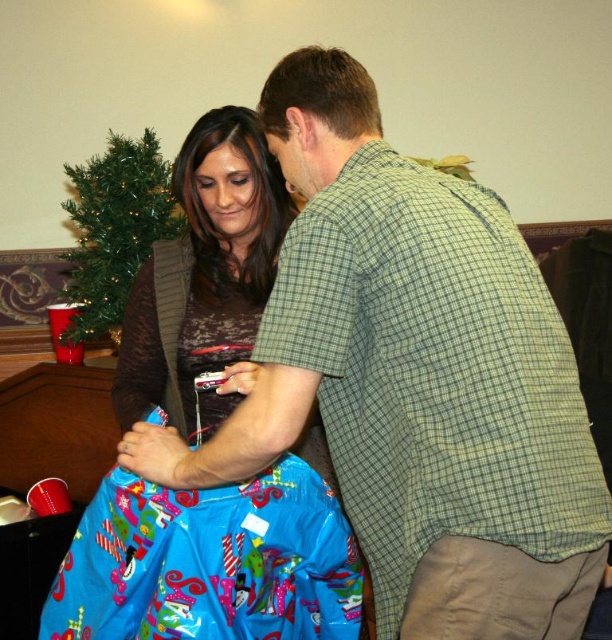
You are organizing a gift wrapping station and need to place the matte brown sweater at center and the green artificial christmas tree at upper left into boxes. The sweater requires a box that can fit its size, and the tree needs a box that can accommodate its height. Given that the sweater is larger, which item will require a larger box in terms of volume?

The matte brown sweater at center requires a larger box because it is bigger than the green artificial christmas tree at upper left.

You are a guest at a Christmas party and notice the matte brown sweater at center and the green artificial christmas tree at upper left. Which object is taller?

The matte brown sweater at center is taller than the green artificial christmas tree at upper left.

You are a guest at a holiday party and notice the matte brown sweater at center and the green artificial christmas tree at upper left. Which object is located to the right of the other?

The matte brown sweater at center is positioned on the right side of green artificial christmas tree at upper left.